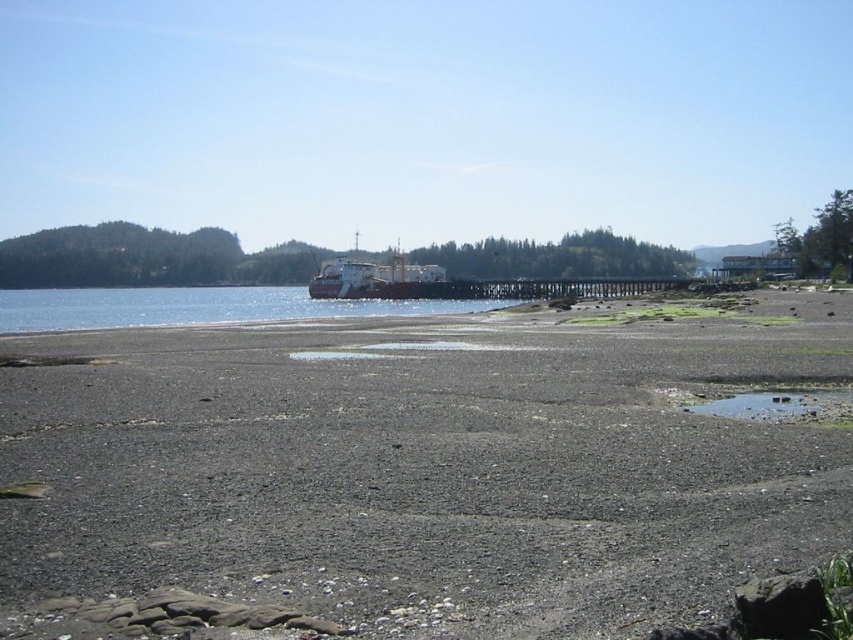
You are standing on the beach and want to reach the clear water at center. Which direction should you walk to get there?

You should walk towards the center of the scene to reach the clear water at center, as it is located at point coordinates of (199, 307).

You are standing on the beach and want to reach the clear water at center. According to the coordinates provided, where should you walk to? Please provide the coordinates in the format of a point like point [199,307].

The coordinates point [199,307] correspond to the clear water at center, so you should walk to point [199,307] to reach it.

You are a beachcomber searching for seashells. You have a small bucket that can only hold items smaller than the clear water at center. Can you collect the gray gravelly sand at center in your bucket?

The gray gravelly sand at center is smaller than clear water at center, so yes, you can collect the gray gravelly sand at center in your bucket since it is smaller than the capacity of your bucket.